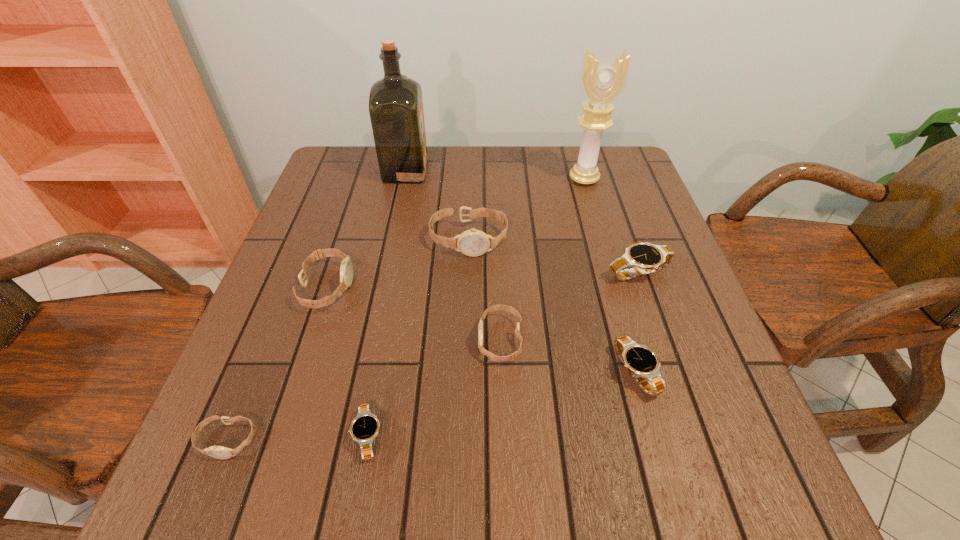
Image resolution: width=960 pixels, height=540 pixels. In order to click on free location that satisfies the following two spatial constraints: 1. on the face of the third smallest beige watch; 2. on the right side of the nearest black watch in this screenshot , I will do `click(278, 436)`.

Locate an element on the screen. The image size is (960, 540). vacant region that satisfies the following two spatial constraints: 1. on the label of the liquor; 2. on the back side of the biggest black watch is located at coordinates (384, 272).

In order to click on vacant region that satisfies the following two spatial constraints: 1. on the back side of the second biggest black watch; 2. on the face of the second smallest beige watch in this screenshot , I will do `click(626, 340)`.

Where is `vacant space that satisfies the following two spatial constraints: 1. on the face of the second farthest beige watch; 2. on the face of the smallest beige watch`? The image size is (960, 540). vacant space that satisfies the following two spatial constraints: 1. on the face of the second farthest beige watch; 2. on the face of the smallest beige watch is located at coordinates click(x=276, y=440).

Locate an element on the screen. Image resolution: width=960 pixels, height=540 pixels. blank area in the image that satisfies the following two spatial constraints: 1. on the back side of the second smallest black watch; 2. on the left side of the farthest black watch is located at coordinates (607, 272).

Where is `free region that satisfies the following two spatial constraints: 1. on the face of the second smallest beige watch; 2. on the front side of the leftmost black watch`? This screenshot has height=540, width=960. free region that satisfies the following two spatial constraints: 1. on the face of the second smallest beige watch; 2. on the front side of the leftmost black watch is located at coordinates (504, 436).

I want to click on vacant area that satisfies the following two spatial constraints: 1. on the face of the farthest watch; 2. on the face of the third nearest beige watch, so pos(468,287).

Where is `free spot that satisfies the following two spatial constraints: 1. on the face of the biggest black watch; 2. on the left side of the tallest watch`? free spot that satisfies the following two spatial constraints: 1. on the face of the biggest black watch; 2. on the left side of the tallest watch is located at coordinates (468, 272).